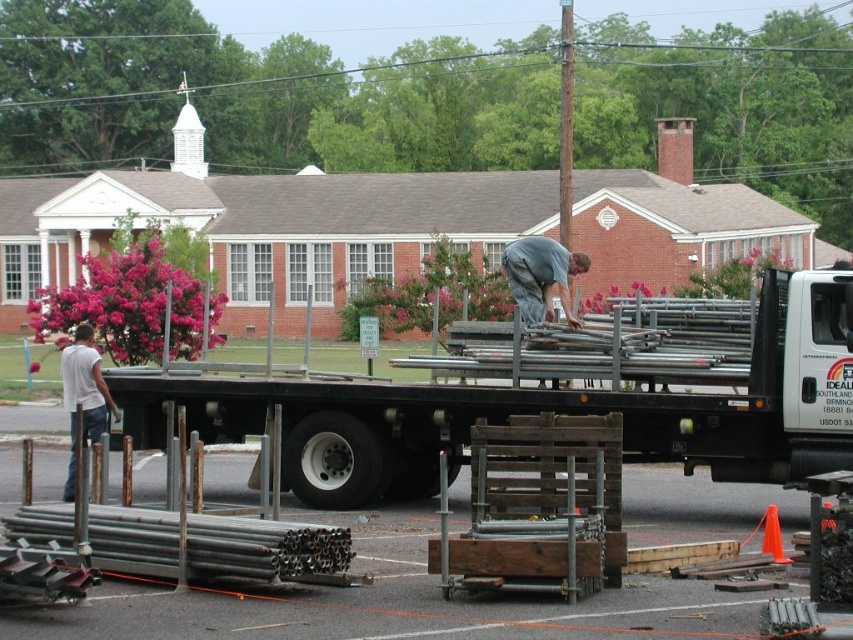
Question: Does metallic silver trailer truck at center have a larger size compared to white cotton shirt at left?

Choices:
 (A) yes
 (B) no

Answer: (B)

Question: Estimate the real-world distances between objects in this image. Which object is closer to the gray fabric shirt at center?

Choices:
 (A) metallic silver trailer truck at center
 (B) white cotton shirt at left

Answer: (A)

Question: Estimate the real-world distances between objects in this image. Which object is farther from the gray fabric shirt at center?

Choices:
 (A) white cotton shirt at left
 (B) metallic silver trailer truck at center

Answer: (A)

Question: Does gray fabric shirt at center have a greater width compared to white cotton shirt at left?

Choices:
 (A) yes
 (B) no

Answer: (B)

Question: Which object is closer to the camera taking this photo?

Choices:
 (A) gray fabric shirt at center
 (B) white cotton shirt at left
 (C) metallic silver trailer truck at center

Answer: (B)

Question: Can you confirm if metallic silver trailer truck at center is smaller than gray fabric shirt at center?

Choices:
 (A) yes
 (B) no

Answer: (A)